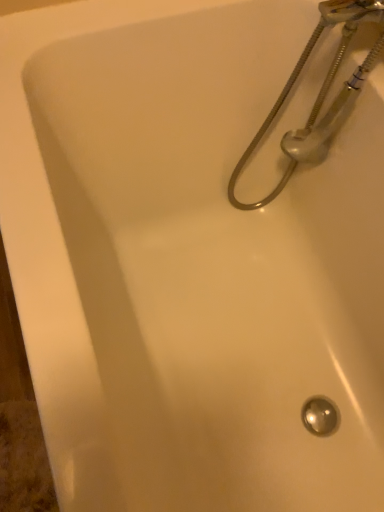
In order to face metallic silver shower head at upper right, should I rotate leftwards or rightwards?

To face it directly, rotate right by 13.182 degrees.

Where is `metallic silver shower head at upper right`? The width and height of the screenshot is (384, 512). metallic silver shower head at upper right is located at coordinates (318, 95).

Describe the element at coordinates (318, 95) in the screenshot. I see `metallic silver shower head at upper right` at that location.

Measure the distance between metallic silver shower head at upper right and camera.

A distance of 28.13 inches exists between metallic silver shower head at upper right and camera.

You are a GUI agent. You are given a task and a screenshot of the screen. Output one action in this format:
    pyautogui.click(x=<x>, y=<y>)
    Task: Click on the metallic silver shower head at upper right
    
    Given the screenshot: What is the action you would take?
    pyautogui.click(x=318, y=95)